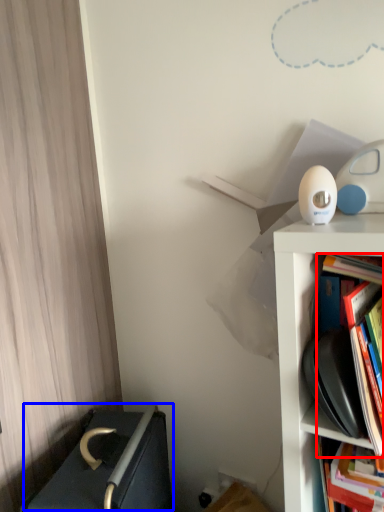
Question: Which of the following is the farthest to the observer, book (highlighted by a red box) or writing (highlighted by a blue box)?

Choices:
 (A) book
 (B) writing

Answer: (B)